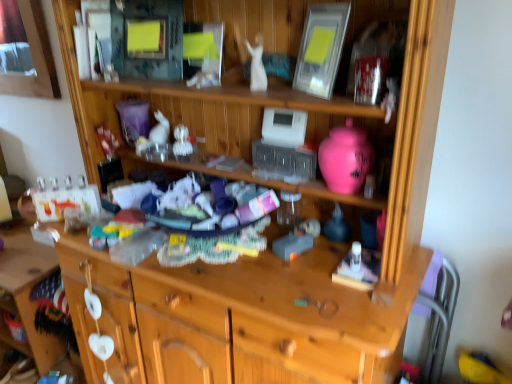
Identify the location of white matte rabbit at center, which is the first toy in back-to-front order. click(x=155, y=134).

Consider the image. Measure the distance between clear plastic ornaments at center, the third toy viewed from the front, and camera.

clear plastic ornaments at center, the third toy viewed from the front, and camera are 1.39 meters apart from each other.

Locate an element on the screen. purple fabric chair at right is located at coordinates (439, 318).

What do you see at coordinates (345, 158) in the screenshot?
I see `pink glossy vase at upper right, the 1th toy in the front-to-back sequence` at bounding box center [345, 158].

This screenshot has height=384, width=512. In order to click on white glossy statue at center, arranged as the 3th toy when viewed from the left in this screenshot , I will do pos(257,65).

Locate an element on the screen. This screenshot has width=512, height=384. white matte rabbit at center, the 4th toy positioned from the right is located at coordinates (155, 134).

Can you confirm if white matte rabbit at center, the 4th toy positioned from the right, is smaller than pink glossy vase at upper right, which is counted as the fourth toy, starting from the left?

Yes.

From the image's perspective, which toy is the 2nd one below the white matte rabbit at center, the 4th toy positioned from the right? Please provide its 2D coordinates.

[(345, 158)]

Does point (139, 147) lie behind point (336, 180)?

That is True.

Looking at this image, can you tell me how much white matte rabbit at center, the 4th toy positioned from the right, and pink glossy vase at upper right, the 1th toy when ordered from right to left, differ in facing direction?

4.95 degrees.

Does point (430, 347) lie in front of point (259, 53)?

No.

Locate an element on the screen. This screenshot has height=384, width=512. chair behind the white glossy statue at center, acting as the second toy starting from the right is located at coordinates (439, 318).

Which of these two, matte silver picture frame at upper center or white matte rabbit at center, marked as the first toy in a left-to-right arrangement, stands taller?

With more height is matte silver picture frame at upper center.

Is matte silver picture frame at upper center further to camera compared to white matte rabbit at center, marked as the first toy in a left-to-right arrangement?

No, it is in front of white matte rabbit at center, marked as the first toy in a left-to-right arrangement.

Can you confirm if matte silver picture frame at upper center is smaller than white matte rabbit at center, the 4th toy positioned from the right?

No.

Considering the sizes of objects matte silver picture frame at upper center and white matte rabbit at center, marked as the first toy in a left-to-right arrangement, in the image provided, who is thinner, matte silver picture frame at upper center or white matte rabbit at center, marked as the first toy in a left-to-right arrangement,?

With smaller width is white matte rabbit at center, marked as the first toy in a left-to-right arrangement.

Is white glossy statue at center, the 2th toy from the front, a part of pink glossy vase at upper right, which is the fourth toy in back-to-front order?

No, white glossy statue at center, the 2th toy from the front, is not a part of pink glossy vase at upper right, which is the fourth toy in back-to-front order.

Does pink glossy vase at upper right, the 1th toy when ordered from right to left, have a greater width compared to white glossy statue at center, acting as the second toy starting from the right?

Yes, pink glossy vase at upper right, the 1th toy when ordered from right to left, is wider than white glossy statue at center, acting as the second toy starting from the right.

What's the angular difference between pink glossy vase at upper right, the 1th toy in the front-to-back sequence, and white glossy statue at center, acting as the second toy starting from the right,'s facing directions?

The angular difference between pink glossy vase at upper right, the 1th toy in the front-to-back sequence, and white glossy statue at center, acting as the second toy starting from the right, is 1.11 degrees.

From the image's perspective, starting from the pink glossy vase at upper right, the 1th toy when ordered from right to left, which toy is the 3rd one above? Please provide its 2D coordinates.

[(257, 65)]

Between white glossy statue at center, acting as the second toy starting from the right, and white matte rabbit at center, which ranks as the fourth toy in front-to-back order, which one has less height?

white matte rabbit at center, which ranks as the fourth toy in front-to-back order.

Is there a large distance between white glossy statue at center, acting as the second toy starting from the right, and white matte rabbit at center, which ranks as the fourth toy in front-to-back order?

No, white glossy statue at center, acting as the second toy starting from the right, is not far from white matte rabbit at center, which ranks as the fourth toy in front-to-back order.

Measure the distance between white glossy statue at center, arranged as the 3th toy when viewed from the left, and white matte rabbit at center, which is the first toy in back-to-front order.

A distance of 18.24 inches exists between white glossy statue at center, arranged as the 3th toy when viewed from the left, and white matte rabbit at center, which is the first toy in back-to-front order.

From a real-world perspective, which is physically above, white glossy statue at center, the 2th toy from the front, or white matte rabbit at center, marked as the first toy in a left-to-right arrangement?

From a 3D spatial view, white glossy statue at center, the 2th toy from the front, is above.

Does purple fabric chair at right touch matte silver picture frame at upper center?

They are not placed beside each other.

Find the location of a particular element. chair behind the matte silver picture frame at upper center is located at coordinates (439, 318).

From the picture: Is purple fabric chair at right situated inside matte silver picture frame at upper center or outside?

purple fabric chair at right is not inside matte silver picture frame at upper center, it's outside.

Considering the sizes of purple fabric chair at right and matte silver picture frame at upper center in the image, is purple fabric chair at right taller or shorter than matte silver picture frame at upper center?

Considering their sizes, purple fabric chair at right has more height than matte silver picture frame at upper center.

Is point (349, 135) positioned in front of point (155, 136)?

Yes.

Considering their positions, is pink glossy vase at upper right, which is the fourth toy in back-to-front order, located in front of or behind white matte rabbit at center, which ranks as the fourth toy in front-to-back order?

In the image, pink glossy vase at upper right, which is the fourth toy in back-to-front order, appears in front of white matte rabbit at center, which ranks as the fourth toy in front-to-back order.

Considering the relative positions of pink glossy vase at upper right, which is counted as the fourth toy, starting from the left, and white matte rabbit at center, the 4th toy positioned from the right, in the image provided, is pink glossy vase at upper right, which is counted as the fourth toy, starting from the left, to the left or to the right of white matte rabbit at center, the 4th toy positioned from the right,?

pink glossy vase at upper right, which is counted as the fourth toy, starting from the left, is to the right of white matte rabbit at center, the 4th toy positioned from the right.

Locate an element on the screen. the 3rd toy in front of the white matte rabbit at center, which ranks as the fourth toy in front-to-back order is located at coordinates (345, 158).

Where is `toy that is the 4th object located above the purple fabric chair at right (from the image's perspective)`? The image size is (512, 384). toy that is the 4th object located above the purple fabric chair at right (from the image's perspective) is located at coordinates (257, 65).

Looking at the image, which one is located further to matte silver picture frame at upper center, white matte rabbit at center, which ranks as the fourth toy in front-to-back order, or white glossy statue at center, arranged as the 3th toy when viewed from the left?

The object further to matte silver picture frame at upper center is white matte rabbit at center, which ranks as the fourth toy in front-to-back order.

When comparing their distances from matte silver picture frame at upper center, does pink glossy vase at upper right, the 1th toy when ordered from right to left, or white glossy statue at center, the 3th toy positioned from the back, seem further?

Based on the image, pink glossy vase at upper right, the 1th toy when ordered from right to left, appears to be further to matte silver picture frame at upper center.

Which object lies further to the anchor point pink glossy vase at upper right, the 1th toy in the front-to-back sequence, clear plastic ornaments at center, the second toy when ordered from back to front, or matte silver picture frame at upper center?

clear plastic ornaments at center, the second toy when ordered from back to front, is further to pink glossy vase at upper right, the 1th toy in the front-to-back sequence.

From the image, which object appears to be farther from white glossy statue at center, the 2th toy from the front, pink glossy vase at upper right, the 1th toy when ordered from right to left, or white matte rabbit at center, which ranks as the fourth toy in front-to-back order?

white matte rabbit at center, which ranks as the fourth toy in front-to-back order.

Based on their spatial positions, is white glossy statue at center, the 3th toy positioned from the back, or pink glossy vase at upper right, which is counted as the fourth toy, starting from the left, closer to white matte rabbit at center, which ranks as the fourth toy in front-to-back order?

white glossy statue at center, the 3th toy positioned from the back.

Consider the image. From the image, which object appears to be farther from matte silver picture frame at upper center, clear plastic ornaments at center, arranged as the second toy when viewed from the left, or white glossy statue at center, the 3th toy positioned from the back?

Among the two, clear plastic ornaments at center, arranged as the second toy when viewed from the left, is located further to matte silver picture frame at upper center.

Consider the image. Estimate the real-world distances between objects in this image. Which object is closer to purple fabric chair at right, white glossy statue at center, the 3th toy positioned from the back, or clear plastic ornaments at center, which is the third toy from right to left?

white glossy statue at center, the 3th toy positioned from the back, is closer to purple fabric chair at right.

Estimate the real-world distances between objects in this image. Which object is further from purple fabric chair at right, matte silver picture frame at upper center or white matte rabbit at center, the 4th toy positioned from the right?

white matte rabbit at center, the 4th toy positioned from the right.

Locate an element on the screen. The width and height of the screenshot is (512, 384). picture frame located between white matte rabbit at center, marked as the first toy in a left-to-right arrangement, and pink glossy vase at upper right, the 1th toy in the front-to-back sequence, in the left-right direction is located at coordinates (321, 48).

Locate an element on the screen. The image size is (512, 384). toy between clear plastic ornaments at center, the second toy when ordered from back to front, and pink glossy vase at upper right, the 1th toy when ordered from right to left, from left to right is located at coordinates (257, 65).

At what (x,y) coordinates should I click in order to perform the action: click on toy between white glossy statue at center, arranged as the 3th toy when viewed from the left, and white matte rabbit at center, the 4th toy positioned from the right, from front to back. Please return your answer as a coordinate pair (x, y). Image resolution: width=512 pixels, height=384 pixels. Looking at the image, I should click on (182, 144).

The width and height of the screenshot is (512, 384). Identify the location of picture frame between clear plastic ornaments at center, the second toy when ordered from back to front, and pink glossy vase at upper right, the 1th toy in the front-to-back sequence, in the horizontal direction. (321, 48).